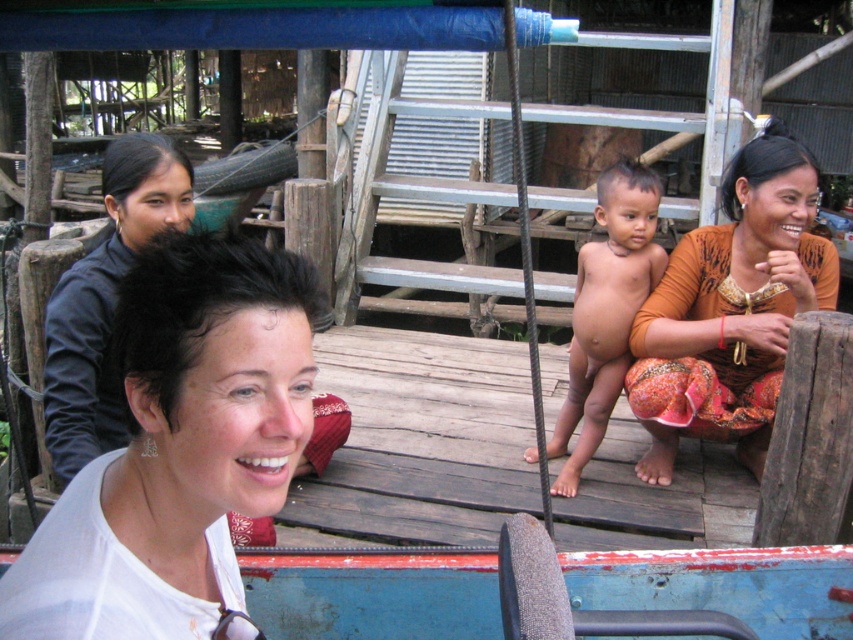
From the picture: You are a photographer trying to capture a group photo of the orange fabric at right and the smooth skin baby at center. If you want to ensure both subjects are fully visible in the frame, which subject requires more space horizontally?

The orange fabric at right requires more space horizontally because its width surpasses that of the smooth skin baby at center.

You are a photographer trying to capture a group photo of the white matte shirt at upper left and the smooth skin baby at center. Since you want to ensure both are in the frame, where should you position yourself relative to the subjects?

You should position yourself to the right of both the white matte shirt at upper left and the smooth skin baby at center so that you can include both in the frame since the white matte shirt at upper left is on the left side of the smooth skin baby at center.

You are a photographer trying to capture a group photo of the orange fabric at right and the smooth skin baby at center. Based on their positions, which one should you focus on first to ensure both are in frame?

The orange fabric at right is to the right of the smooth skin baby at center, so you should focus on the smooth skin baby at center first to ensure both are in frame.